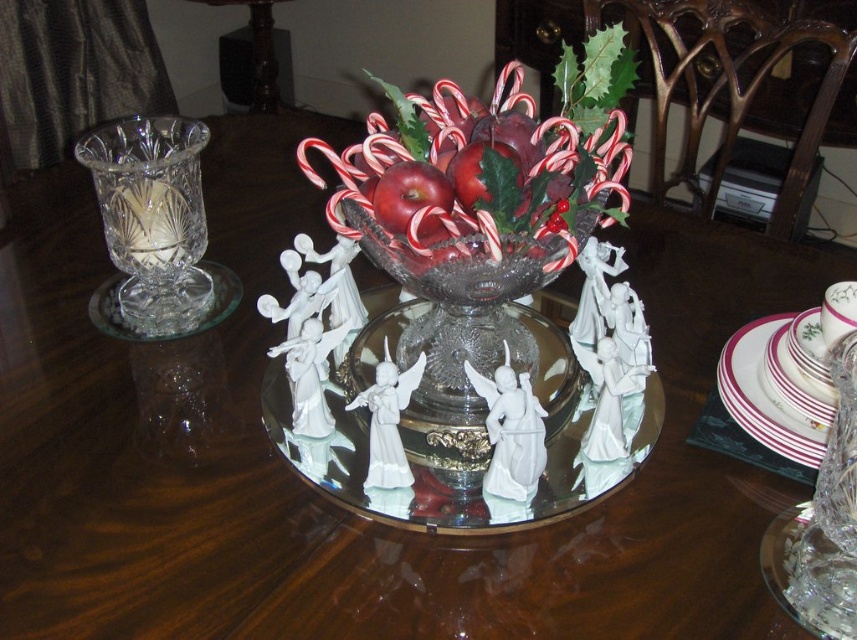
Question: Considering the real-world distances, which object is farthest from the red glossy apple at center?

Choices:
 (A) clear crystal vase at left
 (B) transparent glass plate at center
 (C) transparent glass bowl at center

Answer: (A)

Question: Based on their relative distances, which object is farther from the red glossy apple at center?

Choices:
 (A) transparent glass bowl at center
 (B) transparent glass plate at center
 (C) white ceramic plate at right
 (D) clear crystal vase at left

Answer: (D)

Question: Can you confirm if transparent glass plate at center is positioned to the right of clear crystal vase at left?

Choices:
 (A) yes
 (B) no

Answer: (A)

Question: Is transparent glass plate at center thinner than clear crystal vase at left?

Choices:
 (A) yes
 (B) no

Answer: (B)

Question: Can you confirm if clear crystal vase at left is positioned below red glossy apple at center?

Choices:
 (A) no
 (B) yes

Answer: (A)

Question: Which point is closer to the camera taking this photo?

Choices:
 (A) (400, 225)
 (B) (744, 412)
 (C) (265, 381)

Answer: (A)